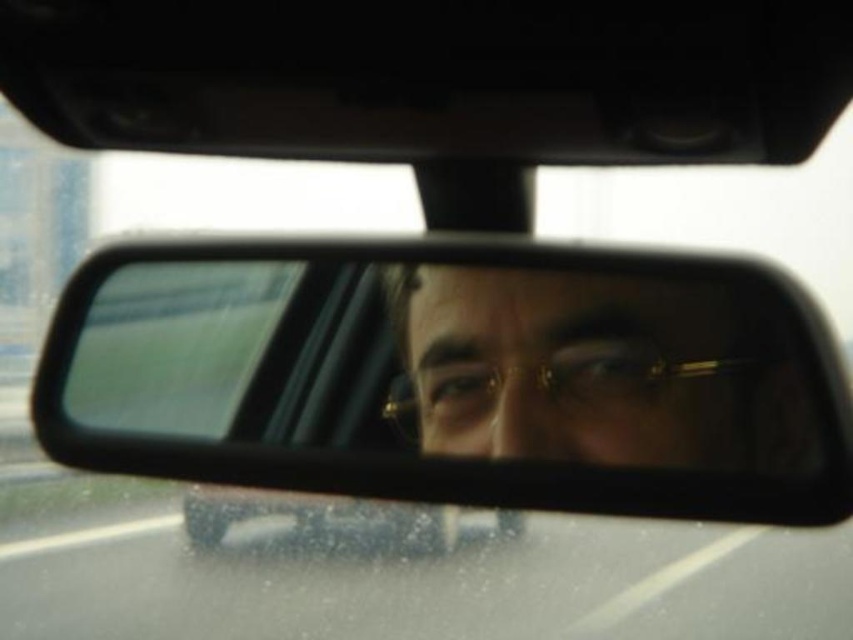
Is clear plastic mirror at center positioned at the back of gold-rimmed glasses at center?

No, it is in front of gold-rimmed glasses at center.

Which of these two, clear plastic mirror at center or gold-rimmed glasses at center, stands shorter?

With less height is gold-rimmed glasses at center.

Which is in front, point (787, 518) or point (515, 410)?

Point (787, 518) is more forward.

At what (x,y) coordinates should I click in order to perform the action: click on clear plastic mirror at center. Please return your answer as a coordinate pair (x, y). Looking at the image, I should click on (453, 376).